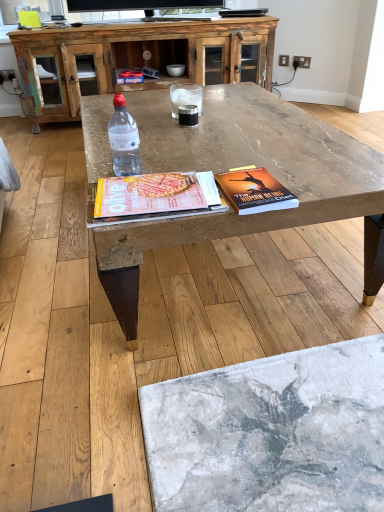
Question: From the image's perspective, is hardcover book at center located above or below transparent plastic bottle at center?

Choices:
 (A) below
 (B) above

Answer: (A)

Question: Looking at the image, does hardcover book at center seem bigger or smaller compared to transparent plastic bottle at center?

Choices:
 (A) big
 (B) small

Answer: (B)

Question: Which is farther from the hardcover book at center?

Choices:
 (A) matte paper magazine at center
 (B) clear glass at center
 (C) rustic wood cabinet at upper center
 (D) marble textured coffee table at center
 (E) black rubberized cup at center

Answer: (C)

Question: Considering the real-world distances, which object is farthest from the rustic wood cabinet at upper center?

Choices:
 (A) clear glass at center
 (B) hardcover book at center
 (C) matte paper magazine at center
 (D) black rubberized cup at center
 (E) marble textured coffee table at center

Answer: (B)